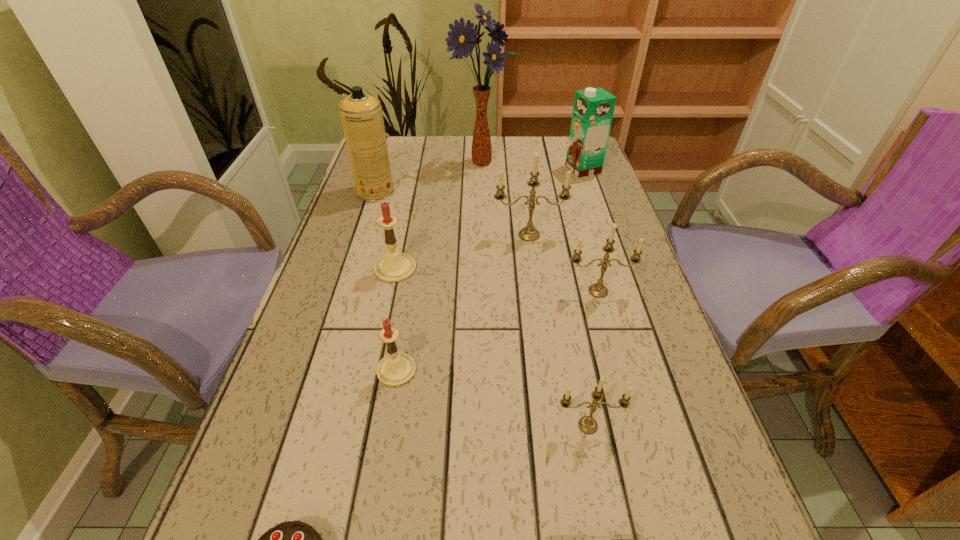
Find the location of a particular element. the second smallest metallic candle is located at coordinates (598, 290).

Locate an element on the screen. The width and height of the screenshot is (960, 540). the nearest metallic candle is located at coordinates (587, 424).

You are a GUI agent. You are given a task and a screenshot of the screen. Output one action in this format:
    pyautogui.click(x=<x>, y=<y>)
    Task: Click on the nearest candle
    Image resolution: width=960 pixels, height=540 pixels.
    Given the screenshot: What is the action you would take?
    pyautogui.click(x=587, y=424)

Locate an element on the screen. the fourth farthest candle is located at coordinates (396, 369).

Where is `the seventh farthest object`? Image resolution: width=960 pixels, height=540 pixels. the seventh farthest object is located at coordinates (396, 369).

Identify the location of vacant area situated 0.260m on the left of the purple flower arrangement. The width and height of the screenshot is (960, 540). [369, 161].

Identify the location of vacant space located 0.380m on the right of the second tallest object. (527, 192).

This screenshot has height=540, width=960. In order to click on free spot located on the left of the carton in this screenshot , I will do `click(481, 169)`.

Identify the location of vacant space situated on the left of the biggest metallic candle. Image resolution: width=960 pixels, height=540 pixels. (449, 235).

Locate an element on the screen. This screenshot has width=960, height=540. vacant space located 0.050m on the front of the farther red candle is located at coordinates (389, 299).